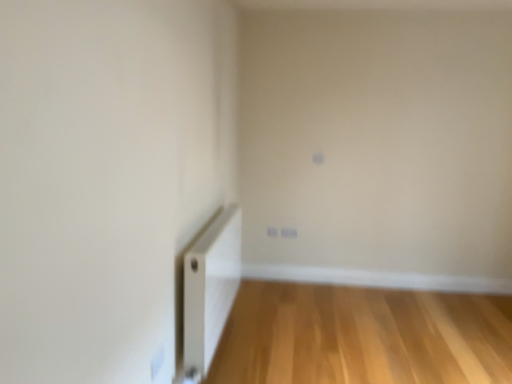
Measure the distance between white plastic radiator at lower left and camera.

white plastic radiator at lower left and camera are 2.04 meters apart.

The width and height of the screenshot is (512, 384). What do you see at coordinates (209, 290) in the screenshot? I see `white plastic radiator at lower left` at bounding box center [209, 290].

The width and height of the screenshot is (512, 384). Identify the location of white plastic radiator at lower left. (209, 290).

What do you see at coordinates (362, 336) in the screenshot? Image resolution: width=512 pixels, height=384 pixels. I see `light wood floor at lower right` at bounding box center [362, 336].

Where is `light wood floor at lower right`? This screenshot has width=512, height=384. light wood floor at lower right is located at coordinates [362, 336].

Locate an element on the screen. This screenshot has height=384, width=512. white plastic radiator at lower left is located at coordinates (209, 290).

Can you confirm if white plastic radiator at lower left is positioned to the right of light wood floor at lower right?

No, white plastic radiator at lower left is not to the right of light wood floor at lower right.

In the image, is white plastic radiator at lower left positioned in front of or behind light wood floor at lower right?

white plastic radiator at lower left is in front of light wood floor at lower right.

Between point (223, 296) and point (504, 363), which one is positioned behind?

Positioned behind is point (223, 296).

From the image's perspective, which one is positioned lower, white plastic radiator at lower left or light wood floor at lower right?

From the image's view, light wood floor at lower right is below.

From a real-world perspective, which is physically above, white plastic radiator at lower left or light wood floor at lower right?

From a 3D spatial view, white plastic radiator at lower left is above.

Does white plastic radiator at lower left have a greater width compared to light wood floor at lower right?

In fact, white plastic radiator at lower left might be narrower than light wood floor at lower right.

Based on the photo, considering the sizes of objects white plastic radiator at lower left and light wood floor at lower right in the image provided, who is shorter, white plastic radiator at lower left or light wood floor at lower right?

Standing shorter between the two is light wood floor at lower right.

Can you confirm if white plastic radiator at lower left is bigger than light wood floor at lower right?

Correct, white plastic radiator at lower left is larger in size than light wood floor at lower right.

Would you say white plastic radiator at lower left is outside light wood floor at lower right?

Yes.

Is white plastic radiator at lower left with light wood floor at lower right?

white plastic radiator at lower left is not next to light wood floor at lower right, and they're not touching.

Is white plastic radiator at lower left oriented away from light wood floor at lower right?

No, light wood floor at lower right is not at the back of white plastic radiator at lower left.

Looking at this image, what's the angular difference between white plastic radiator at lower left and light wood floor at lower right's facing directions?

90.7 degrees separate the facing orientations of white plastic radiator at lower left and light wood floor at lower right.

Locate an element on the screen. Image resolution: width=512 pixels, height=384 pixels. corridor behind the white plastic radiator at lower left is located at coordinates (362, 336).

Considering the relative positions of light wood floor at lower right and white plastic radiator at lower left in the image provided, is light wood floor at lower right to the right of white plastic radiator at lower left from the viewer's perspective?

Correct, you'll find light wood floor at lower right to the right of white plastic radiator at lower left.

Between light wood floor at lower right and white plastic radiator at lower left, which one is positioned behind?

light wood floor at lower right.

Does point (355, 364) lie behind point (186, 325)?

Yes.

From the image's perspective, does light wood floor at lower right appear lower than white plastic radiator at lower left?

Correct, light wood floor at lower right appears lower than white plastic radiator at lower left in the image.

From a real-world perspective, does light wood floor at lower right stand above white plastic radiator at lower left?

No.

Consider the image. Which of these two, light wood floor at lower right or white plastic radiator at lower left, is wider?

light wood floor at lower right.

From their relative heights in the image, would you say light wood floor at lower right is taller or shorter than white plastic radiator at lower left?

Considering their sizes, light wood floor at lower right has less height than white plastic radiator at lower left.

Between light wood floor at lower right and white plastic radiator at lower left, which one has larger size?

white plastic radiator at lower left is bigger.

Would you say light wood floor at lower right is outside white plastic radiator at lower left?

light wood floor at lower right is positioned outside white plastic radiator at lower left.

Is light wood floor at lower right positioned far away from white plastic radiator at lower left?

No, light wood floor at lower right is not far from white plastic radiator at lower left.

Is light wood floor at lower right oriented towards white plastic radiator at lower left?

No.

In the image, there is a white plastic radiator at lower left. Identify the location of corridor below it (from the image's perspective). Image resolution: width=512 pixels, height=384 pixels. (362, 336).

Where is `corridor beneath the white plastic radiator at lower left (from a real-world perspective)`? Image resolution: width=512 pixels, height=384 pixels. corridor beneath the white plastic radiator at lower left (from a real-world perspective) is located at coordinates (362, 336).

Identify the location of corridor that appears behind the white plastic radiator at lower left. (362, 336).